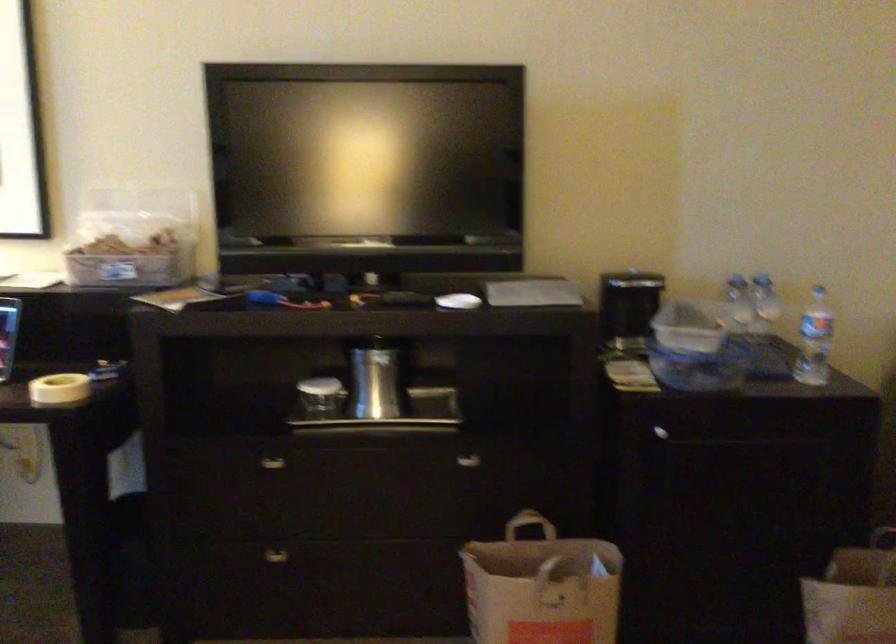
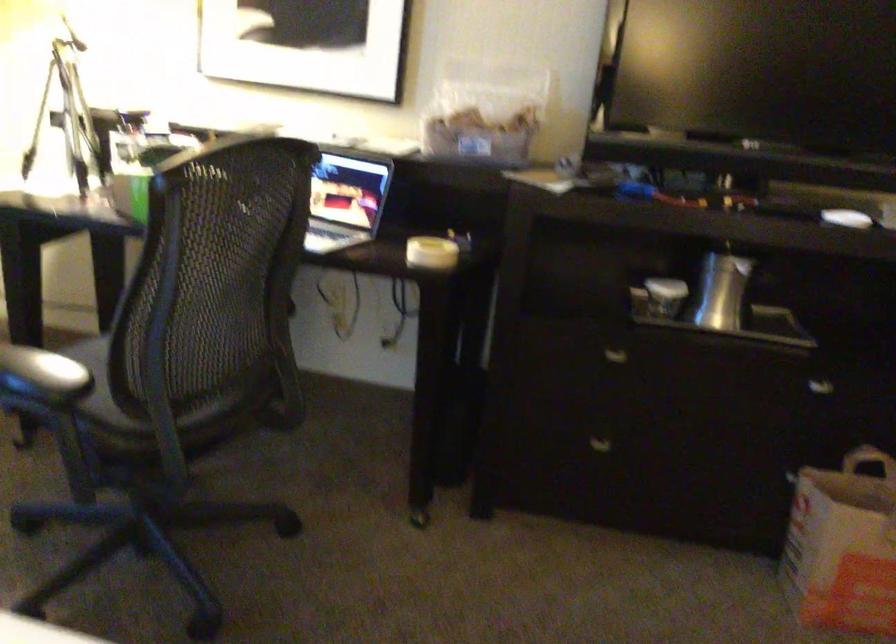
Question: The images are taken continuously from a first-person perspective. In which direction are you moving?

Choices:
 (A) Left
 (B) Right
 (C) Forward
 (D) Backward

Answer: (A)